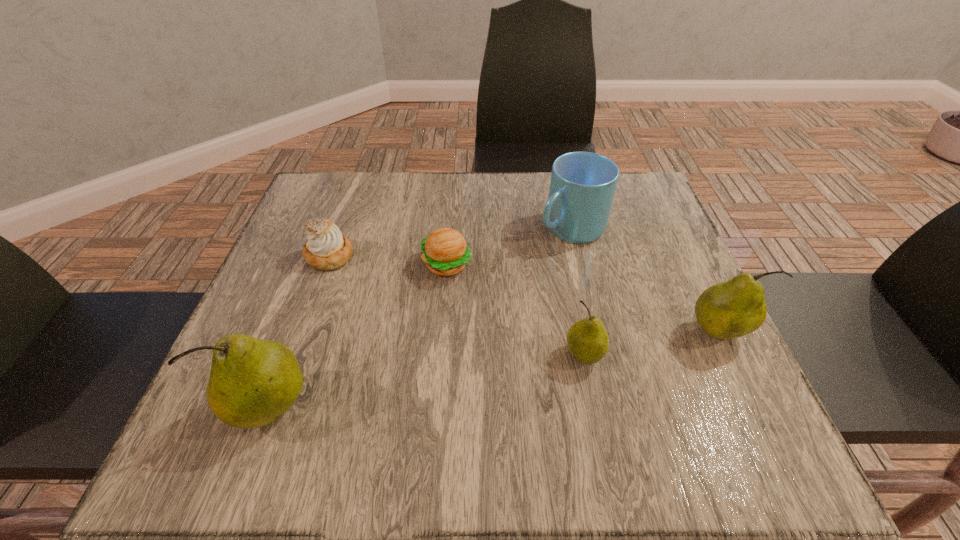
This screenshot has width=960, height=540. I want to click on object that is at the far right corner, so click(x=582, y=187).

The image size is (960, 540). I want to click on vacant space at the far edge of the desktop, so click(430, 183).

In the image, there is a desktop. Identify the location of free space at the near edge. tap(591, 378).

The image size is (960, 540). I want to click on vacant point at the left edge, so click(284, 291).

This screenshot has width=960, height=540. In the image, there is a desktop. Find the location of `vacant space at the right edge`. vacant space at the right edge is located at coordinates (632, 272).

Locate an element on the screen. Image resolution: width=960 pixels, height=540 pixels. vacant space at the far left corner is located at coordinates (336, 193).

Image resolution: width=960 pixels, height=540 pixels. Find the location of `empty space between the nearest pear and the fourth object from right to left`. empty space between the nearest pear and the fourth object from right to left is located at coordinates (360, 336).

The width and height of the screenshot is (960, 540). I want to click on free space between the mug and the third object from left to right, so click(x=509, y=246).

This screenshot has height=540, width=960. I want to click on vacant area that lies between the hamburger and the mug, so click(x=509, y=246).

The image size is (960, 540). I want to click on unoccupied area between the pastry and the second pear from right to left, so click(457, 306).